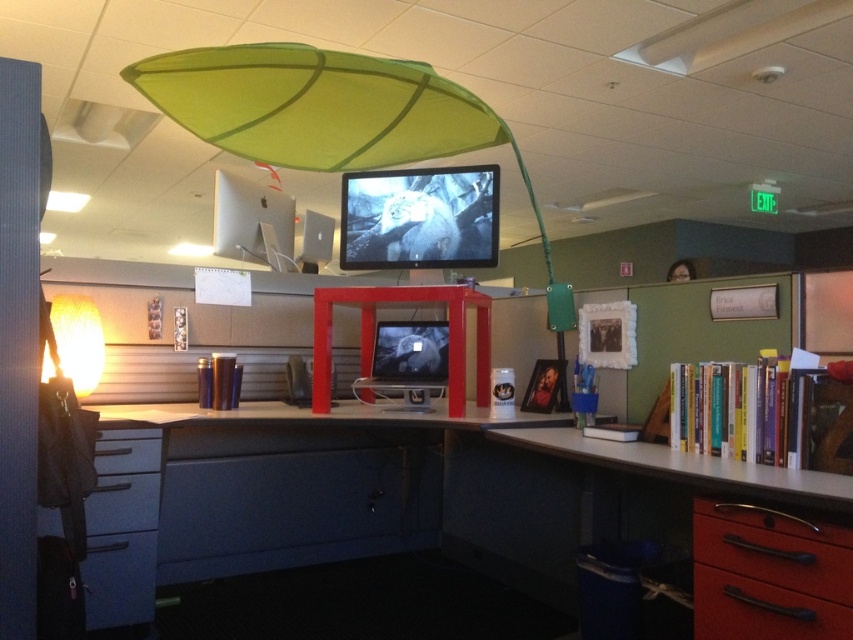
Is point (711, 573) positioned after point (119, 435)?

No, it is in front of (119, 435).

Does metallic gray desk at right have a lesser height compared to blue plastic drawer at lower left?

Yes, metallic gray desk at right is shorter than blue plastic drawer at lower left.

You are a GUI agent. You are given a task and a screenshot of the screen. Output one action in this format:
    pyautogui.click(x=<x>, y=<y>)
    Task: Click on the metallic gray desk at right
    This screenshot has height=640, width=853.
    Given the screenshot: What is the action you would take?
    pyautogui.click(x=728, y=528)

This screenshot has height=640, width=853. Describe the element at coordinates (436, 486) in the screenshot. I see `matte gray computer desk at center` at that location.

I want to click on matte gray computer desk at center, so click(436, 486).

Is point (695, 588) positioned behind point (848, 435)?

Yes, point (695, 588) is behind point (848, 435).

Can you confirm if black metal drawer at lower right is wider than hardcover books at right?

No, black metal drawer at lower right is not wider than hardcover books at right.

Which is in front, point (825, 556) or point (843, 392)?

Point (825, 556) is more forward.

Image resolution: width=853 pixels, height=640 pixels. Find the location of `black metal drawer at lower right`. black metal drawer at lower right is located at coordinates (766, 577).